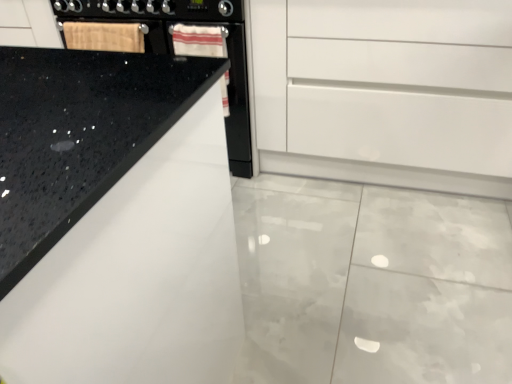
This screenshot has height=384, width=512. What do you see at coordinates (386, 92) in the screenshot?
I see `white glossy cabinet at center` at bounding box center [386, 92].

What is the approximate width of black granite countertop at upper left?

The width of black granite countertop at upper left is 26.72 inches.

I want to click on white glossy cabinet at center, so click(386, 92).

Is black granite countertop at upper left not within wooden cutting board at upper left?

black granite countertop at upper left is positioned outside wooden cutting board at upper left.

How different are the orientations of black granite countertop at upper left and wooden cutting board at upper left in degrees?

black granite countertop at upper left and wooden cutting board at upper left are facing 1.38 degrees away from each other.

Is point (3, 230) positioned after point (137, 50)?

No, (3, 230) is closer to viewer.

Is black granite countertop at upper left positioned with its back to wooden cutting board at upper left?

That's right, black granite countertop at upper left is facing away from wooden cutting board at upper left.

Are white glossy cabinet at center and black granite countertop at upper left located far from each other?

Yes, white glossy cabinet at center and black granite countertop at upper left are quite far apart.

Between white glossy cabinet at center and black granite countertop at upper left, which one has larger width?

black granite countertop at upper left.

From a real-world perspective, is white glossy cabinet at center positioned over black granite countertop at upper left based on gravity?

No.

Is wooden cutting board at upper left in contact with black granite countertop at upper left?

No, wooden cutting board at upper left is not with black granite countertop at upper left.

This screenshot has height=384, width=512. I want to click on countertop that appears on the right of wooden cutting board at upper left, so click(x=78, y=135).

Which of these two, wooden cutting board at upper left or black granite countertop at upper left, stands shorter?

With less height is wooden cutting board at upper left.

Can you confirm if wooden cutting board at upper left is smaller than black granite countertop at upper left?

Yes, wooden cutting board at upper left is smaller than black granite countertop at upper left.

Which object is positioned more to the right, wooden cutting board at upper left or white glossy cabinet at center?

Positioned to the right is white glossy cabinet at center.

Is wooden cutting board at upper left oriented away from white glossy cabinet at center?

A: No, wooden cutting board at upper left is not facing the opposite direction of white glossy cabinet at center.

Consider the image. Can you confirm if wooden cutting board at upper left is shorter than white glossy cabinet at center?

Yes, wooden cutting board at upper left is shorter than white glossy cabinet at center.

Considering the positions of point (92, 111) and point (467, 60), is point (92, 111) closer or farther from the camera than point (467, 60)?

Clearly, point (92, 111) is closer to the camera than point (467, 60).

Which of these two, black granite countertop at upper left or white glossy cabinet at center, stands shorter?

Standing shorter between the two is white glossy cabinet at center.

From the image's perspective, which is above, black granite countertop at upper left or white glossy cabinet at center?

white glossy cabinet at center appears higher in the image.

Looking at their sizes, would you say black granite countertop at upper left is wider or thinner than white glossy cabinet at center?

Clearly, black granite countertop at upper left has more width compared to white glossy cabinet at center.

How different are the orientations of white glossy cabinet at center and wooden cutting board at upper left in degrees?

white glossy cabinet at center and wooden cutting board at upper left are facing 1.65 degrees away from each other.

Considering the positions of point (492, 73) and point (96, 49), is point (492, 73) closer or farther from the camera than point (96, 49)?

Point (492, 73) is closer to the camera than point (96, 49).

Based on their sizes in the image, would you say white glossy cabinet at center is bigger or smaller than wooden cutting board at upper left?

In the image, white glossy cabinet at center appears to be larger than wooden cutting board at upper left.

Identify the location of material that is behind the black granite countertop at upper left. This screenshot has height=384, width=512. (104, 36).

You are a GUI agent. You are given a task and a screenshot of the screen. Output one action in this format:
    pyautogui.click(x=<x>, y=<y>)
    Task: Click on the countertop lying on the left of white glossy cabinet at center
    This screenshot has height=384, width=512.
    Given the screenshot: What is the action you would take?
    coord(78,135)

Looking at the image, which one is located further to wooden cutting board at upper left, black granite countertop at upper left or white glossy cabinet at center?

black granite countertop at upper left lies further to wooden cutting board at upper left than the other object.

Considering their positions, is black granite countertop at upper left positioned further to white glossy cabinet at center than wooden cutting board at upper left?

black granite countertop at upper left is positioned further to the anchor white glossy cabinet at center.

Based on their spatial positions, is white glossy cabinet at center or wooden cutting board at upper left closer to black granite countertop at upper left?

Among the two, wooden cutting board at upper left is located nearer to black granite countertop at upper left.

Consider the image. Looking at the image, which one is located closer to white glossy cabinet at center, wooden cutting board at upper left or black granite countertop at upper left?

The object closer to white glossy cabinet at center is wooden cutting board at upper left.

Based on their spatial positions, is white glossy cabinet at center or black granite countertop at upper left further from wooden cutting board at upper left?

black granite countertop at upper left is positioned further to the anchor wooden cutting board at upper left.

Which object lies further to the anchor point black granite countertop at upper left, wooden cutting board at upper left or white glossy cabinet at center?

Among the two, white glossy cabinet at center is located further to black granite countertop at upper left.

At what (x,y) coordinates should I click in order to perform the action: click on countertop between wooden cutting board at upper left and white glossy cabinet at center. Please return your answer as a coordinate pair (x, y). Looking at the image, I should click on click(x=78, y=135).